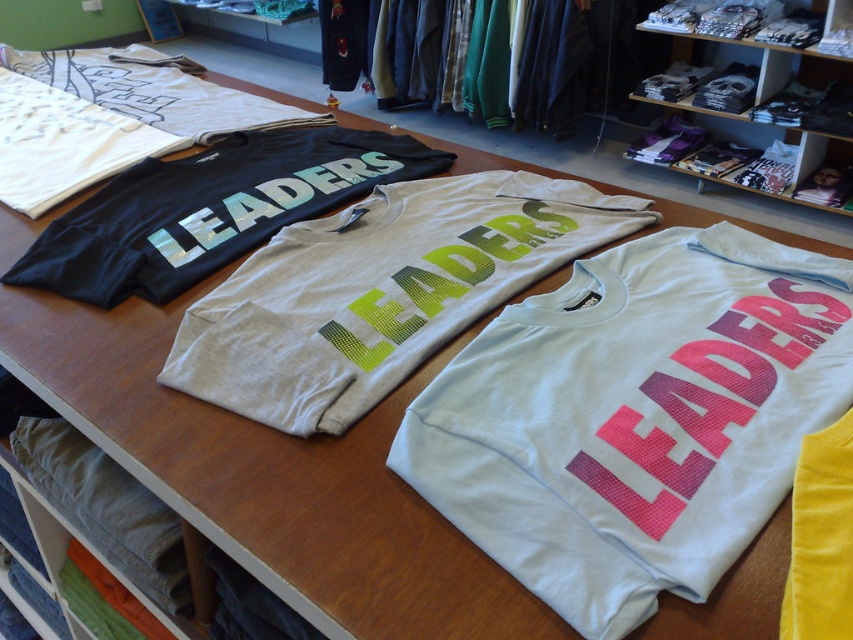
Between black matte t-shirt at center and denim pants at lower left, which one appears on the left side from the viewer's perspective?

From the viewer's perspective, denim pants at lower left appears more on the left side.

Does black matte t-shirt at center appear over denim pants at lower left?

Indeed, black matte t-shirt at center is positioned over denim pants at lower left.

Is point (131, 282) farther from viewer compared to point (105, 493)?

That is False.

Where is `black matte t-shirt at center`? The width and height of the screenshot is (853, 640). black matte t-shirt at center is located at coordinates (210, 209).

Who is more distant from viewer, (379,336) or (44,230)?

The point (44,230) is behind.

Is white cotton t-shirt at center thinner than black matte t-shirt at center?

No.

Locate an element on the screen. Image resolution: width=853 pixels, height=640 pixels. white cotton t-shirt at center is located at coordinates (380, 291).

Who is more forward, (509, 259) or (840, 529)?

Point (840, 529) is more forward.

Who is more forward, (x=509, y=284) or (x=821, y=432)?

Point (x=821, y=432)

Find the location of a particular element. This screenshot has width=853, height=640. white cotton t-shirt at center is located at coordinates (380, 291).